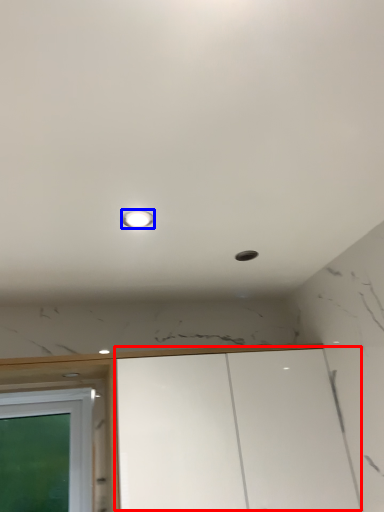
Question: Which object is further to the camera taking this photo, cabinetry (highlighted by a red box) or light (highlighted by a blue box)?

Choices:
 (A) cabinetry
 (B) light

Answer: (A)